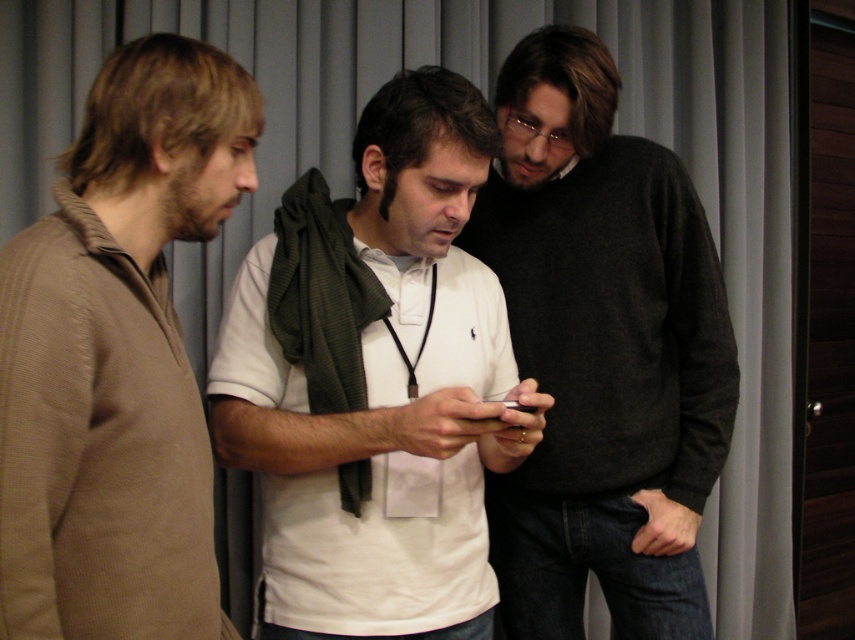
At what (x,y) coordinates should I click in order to perform the action: click on white matte shirt at center. Please return your answer as a coordinate pair (x, y). This screenshot has width=855, height=640. Looking at the image, I should click on (376, 381).

Which of these two, white matte shirt at center or dark gray sweater at center, stands shorter?

Standing shorter between the two is white matte shirt at center.

Is point (346, 428) more distant than point (528, 237)?

No, it is not.

Where is `white matte shirt at center`? white matte shirt at center is located at coordinates (376, 381).

Who is shorter, dark gray sweater at center or knitted brown sweater at left?

With less height is knitted brown sweater at left.

Between point (718, 284) and point (89, 502), which one is positioned in front?

Positioned in front is point (89, 502).

Is point (624, 600) in front of point (124, 529)?

No, (624, 600) is further to viewer.

Find the location of a particular element. The image size is (855, 640). dark gray sweater at center is located at coordinates (600, 353).

Between point (394, 212) and point (133, 275), which one is positioned in front?

Point (133, 275) is more forward.

Is white matte shirt at center wider than knitted brown sweater at left?

Yes, white matte shirt at center is wider than knitted brown sweater at left.

I want to click on white matte shirt at center, so click(x=376, y=381).

The height and width of the screenshot is (640, 855). What are the coordinates of `white matte shirt at center` in the screenshot? It's located at (376, 381).